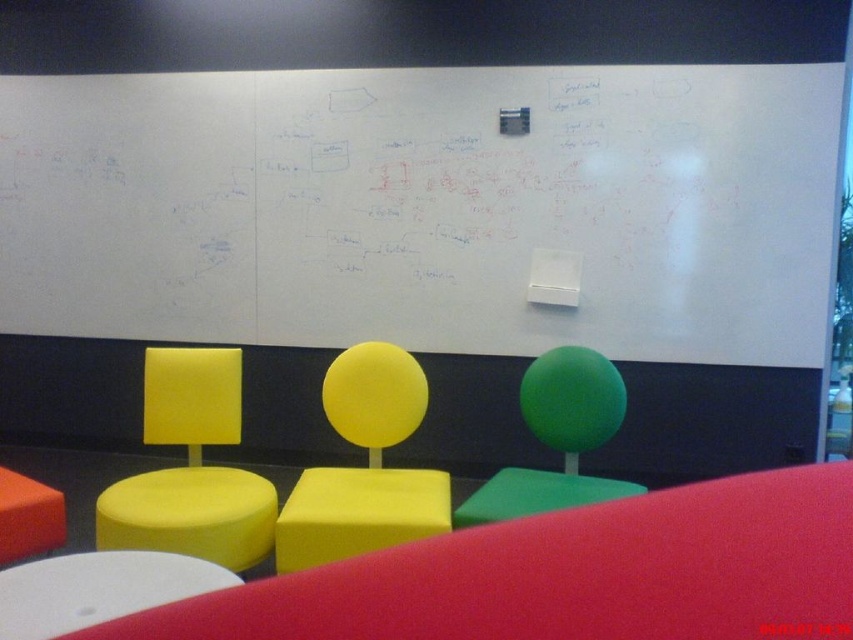
Is matte yellow chair at left thinner than matte orange stool at lower left?

Incorrect, matte yellow chair at left's width is not less than matte orange stool at lower left's.

Where is `matte yellow chair at left`? This screenshot has width=853, height=640. matte yellow chair at left is located at coordinates (190, 468).

Between point (225, 404) and point (27, 513), which one is positioned in front?

Point (27, 513) is in front.

This screenshot has height=640, width=853. I want to click on matte yellow chair at left, so click(190, 468).

Does green foam chair at right appear over matte orange stool at lower left?

Yes.

Who is higher up, green foam chair at right or matte orange stool at lower left?

green foam chair at right is higher up.

Is point (567, 483) less distant than point (3, 554)?

No, (567, 483) is behind (3, 554).

The image size is (853, 640). Find the location of `green foam chair at right`. green foam chair at right is located at coordinates (556, 438).

Is white matte stool at lower left thinner than matte orange stool at lower left?

Incorrect, white matte stool at lower left's width is not less than matte orange stool at lower left's.

Is point (28, 589) closer to viewer compared to point (28, 506)?

That is True.

Is point (16, 576) positioned after point (30, 488)?

No, (16, 576) is closer to viewer.

Where is `white matte stool at lower left`? The height and width of the screenshot is (640, 853). white matte stool at lower left is located at coordinates (97, 588).